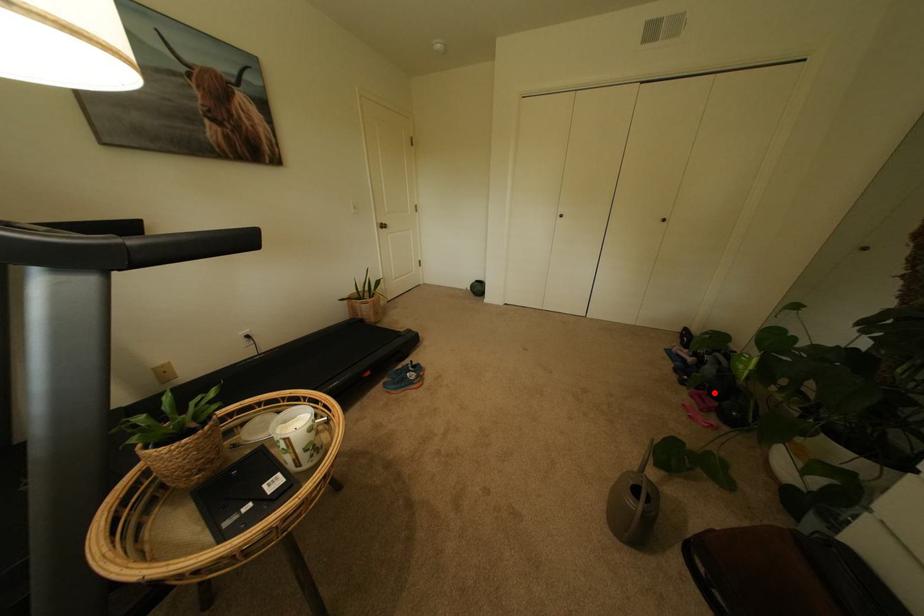
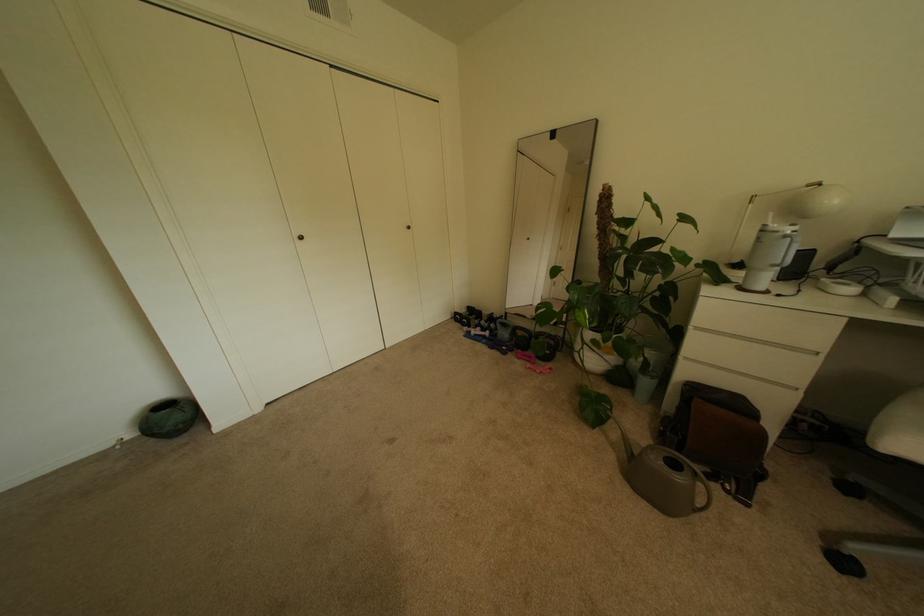
In the second image, find the point that corresponds to the highlighted location in the first image.

(524, 350)